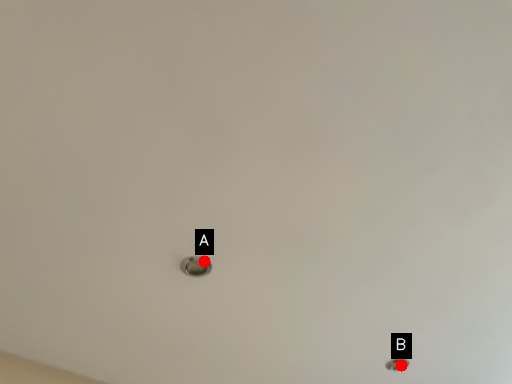
Question: Two points are circled on the image, labeled by A and B beside each circle. Among these points, which one is farthest from the camera?

Choices:
 (A) A is further
 (B) B is further

Answer: (B)